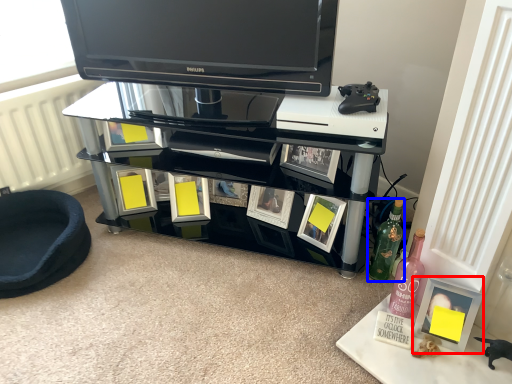
Question: Which object is closer to the camera taking this photo, picture frame (highlighted by a red box) or bottle (highlighted by a blue box)?

Choices:
 (A) picture frame
 (B) bottle

Answer: (A)